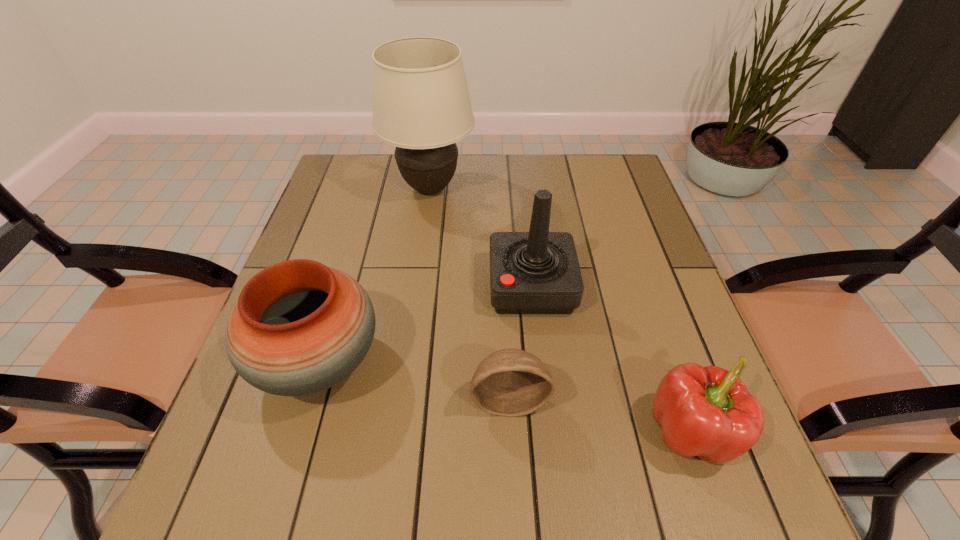
The width and height of the screenshot is (960, 540). Identify the location of vacant space in between the tallest object and the pottery. (374, 275).

The width and height of the screenshot is (960, 540). Identify the location of free spot between the pepper and the bowl. (600, 415).

Where is `vacant region between the pottery and the tallest object`? vacant region between the pottery and the tallest object is located at coordinates (374, 275).

Locate an element on the screen. The image size is (960, 540). unoccupied area between the rightmost object and the bowl is located at coordinates (600, 415).

Locate an element on the screen. empty space between the rightmost object and the bowl is located at coordinates (600, 415).

Select which object appears as the closest to the farthest object. Please provide its 2D coordinates. Your answer should be formatted as a tuple, i.e. [(x, y)], where the tuple contains the x and y coordinates of a point satisfying the conditions above.

[(537, 272)]

Identify which object is the second nearest to the joystick. Please provide its 2D coordinates. Your answer should be formatted as a tuple, i.e. [(x, y)], where the tuple contains the x and y coordinates of a point satisfying the conditions above.

[(421, 104)]

The width and height of the screenshot is (960, 540). I want to click on vacant point that satisfies the following two spatial constraints: 1. on the front-facing side of the rightmost object; 2. on the left side of the fourth shortest object, so click(x=547, y=431).

Where is `vacant position in the image that satisfies the following two spatial constraints: 1. on the front side of the bowl; 2. on the right side of the pottery`? This screenshot has width=960, height=540. vacant position in the image that satisfies the following two spatial constraints: 1. on the front side of the bowl; 2. on the right side of the pottery is located at coordinates (309, 399).

Locate an element on the screen. free location that satisfies the following two spatial constraints: 1. on the back side of the tallest object; 2. on the left side of the third shortest object is located at coordinates (372, 188).